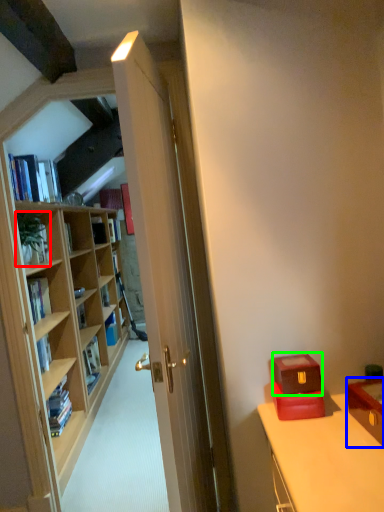
Question: Which object is positioned farthest from houseplant (highlighted by a red box)? Select from file cabinet (highlighted by a blue box) and box (highlighted by a green box).

Choices:
 (A) file cabinet
 (B) box

Answer: (A)